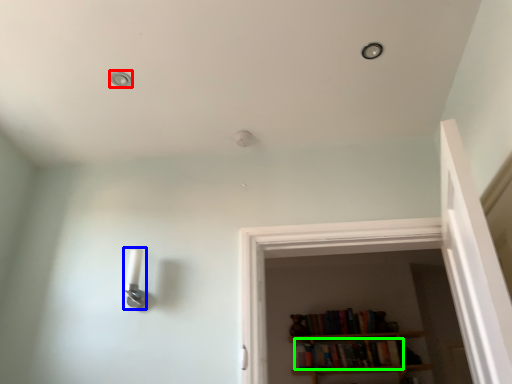
Question: Which object is the farthest from dot (highlighted by a red box)? Choose among these: light fixture (highlighted by a blue box) or book (highlighted by a green box).

Choices:
 (A) light fixture
 (B) book

Answer: (B)